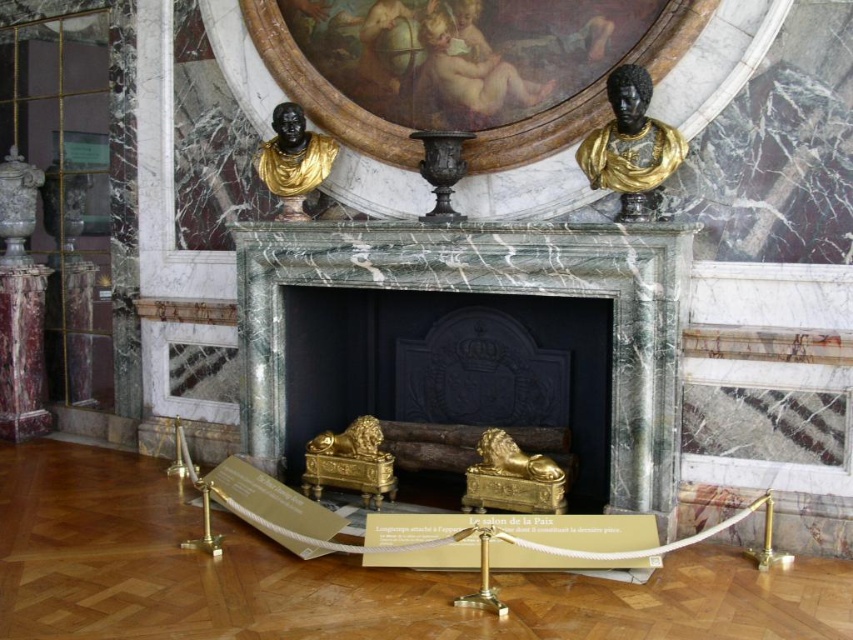
Does green marble fireplace at center appear on the right side of matte gray vase at upper left?

Correct, you'll find green marble fireplace at center to the right of matte gray vase at upper left.

Which is more to the right, green marble fireplace at center or matte gray vase at upper left?

From the viewer's perspective, green marble fireplace at center appears more on the right side.

Where is `green marble fireplace at center`? The image size is (853, 640). green marble fireplace at center is located at coordinates (488, 292).

Is point (328, 161) in front of point (15, 179)?

Yes.

Who is lower down, black marble bust at upper left or matte gray vase at upper left?

Positioned lower is matte gray vase at upper left.

Describe the element at coordinates (293, 160) in the screenshot. I see `black marble bust at upper left` at that location.

At what (x,y) coordinates should I click in order to perform the action: click on black marble bust at upper left. Please return your answer as a coordinate pair (x, y). Looking at the image, I should click on click(293, 160).

Which is more to the left, green marble fireplace at center or black marble bust at upper left?

From the viewer's perspective, black marble bust at upper left appears more on the left side.

Does green marble fireplace at center appear over black marble bust at upper left?

No.

This screenshot has height=640, width=853. What are the coordinates of `green marble fireplace at center` in the screenshot? It's located at (488, 292).